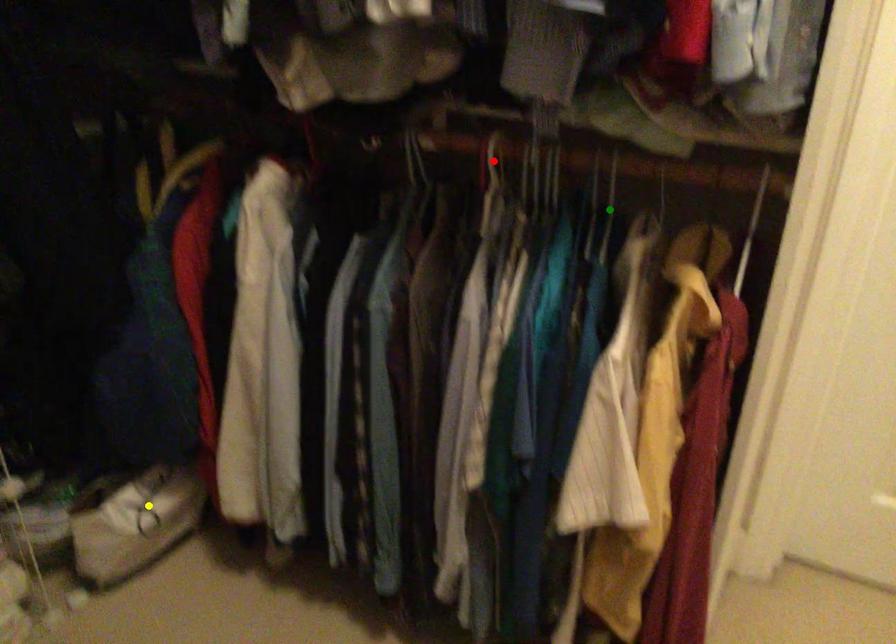
Order these from nearest to farthest:
yellow point | green point | red point

red point
green point
yellow point